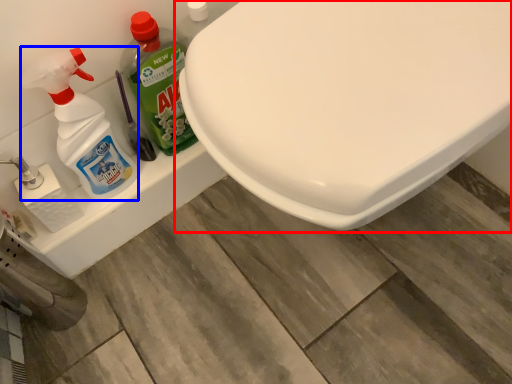
Question: Which of the following is the closest to the observer, toilet (highlighted by a red box) or cleaning product (highlighted by a blue box)?

Choices:
 (A) toilet
 (B) cleaning product

Answer: (A)